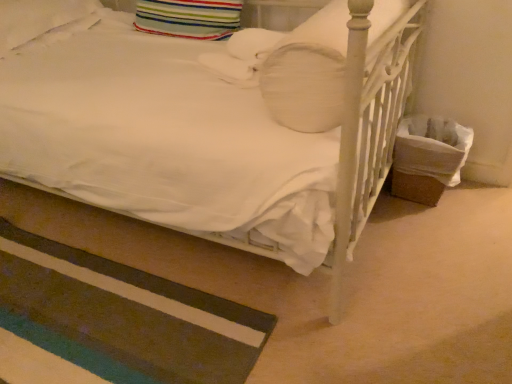
Question: Which direction should I rotate to look at striped fabric pillow at upper center, placed as the second pillow when sorted from left to right, — up or down?

Choices:
 (A) up
 (B) down

Answer: (A)

Question: From the image's perspective, is striped fabric pillow at upper center, placed as the second pillow when sorted from left to right, beneath white soft pillow at upper left, which is counted as the 3th pillow, starting from the right?

Choices:
 (A) yes
 (B) no

Answer: (A)

Question: From a real-world perspective, is striped fabric pillow at upper center, placed as the second pillow when sorted from left to right, over white soft pillow at upper left, which is counted as the 3th pillow, starting from the right?

Choices:
 (A) no
 (B) yes

Answer: (B)

Question: From a real-world perspective, is striped fabric pillow at upper center, acting as the second pillow starting from the right, under white soft pillow at upper left, which is counted as the 3th pillow, starting from the right?

Choices:
 (A) yes
 (B) no

Answer: (B)

Question: Does striped fabric pillow at upper center, acting as the second pillow starting from the right, come behind white soft pillow at upper left, which is counted as the 3th pillow, starting from the right?

Choices:
 (A) no
 (B) yes

Answer: (B)

Question: Does striped fabric pillow at upper center, acting as the second pillow starting from the right, have a smaller size compared to white soft pillow at upper left, which is counted as the 3th pillow, starting from the right?

Choices:
 (A) yes
 (B) no

Answer: (A)

Question: Can you confirm if striped fabric pillow at upper center, acting as the second pillow starting from the right, is bigger than white soft pillow at upper left, which is counted as the 3th pillow, starting from the right?

Choices:
 (A) no
 (B) yes

Answer: (A)

Question: Is the surface of striped fabric pillow at upper center, acting as the second pillow starting from the right, in direct contact with striped carpet at lower left?

Choices:
 (A) yes
 (B) no

Answer: (B)

Question: From the image's perspective, is striped fabric pillow at upper center, acting as the second pillow starting from the right, below striped carpet at lower left?

Choices:
 (A) no
 (B) yes

Answer: (A)

Question: Is striped fabric pillow at upper center, placed as the second pillow when sorted from left to right, positioned with its back to striped carpet at lower left?

Choices:
 (A) yes
 (B) no

Answer: (B)

Question: Is striped fabric pillow at upper center, acting as the second pillow starting from the right, located outside striped carpet at lower left?

Choices:
 (A) yes
 (B) no

Answer: (A)

Question: Considering the relative positions of striped fabric pillow at upper center, placed as the second pillow when sorted from left to right, and striped carpet at lower left in the image provided, is striped fabric pillow at upper center, placed as the second pillow when sorted from left to right, in front of striped carpet at lower left?

Choices:
 (A) yes
 (B) no

Answer: (B)

Question: Does striped fabric pillow at upper center, acting as the second pillow starting from the right, have a greater width compared to striped carpet at lower left?

Choices:
 (A) yes
 (B) no

Answer: (B)

Question: Does white soft pillow at upper left, which ranks as the first pillow in left-to-right order, turn towards striped carpet at lower left?

Choices:
 (A) no
 (B) yes

Answer: (A)